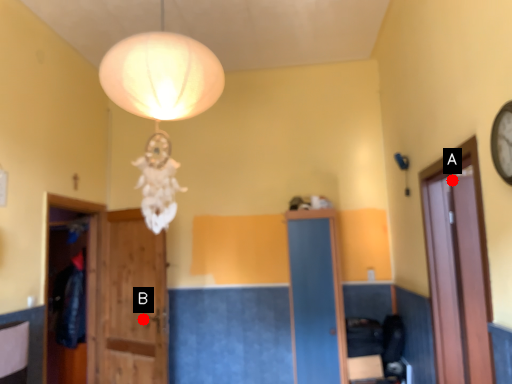
Question: Two points are circled on the image, labeled by A and B beside each circle. Which point is closer to the camera?

Choices:
 (A) A is closer
 (B) B is closer

Answer: (A)